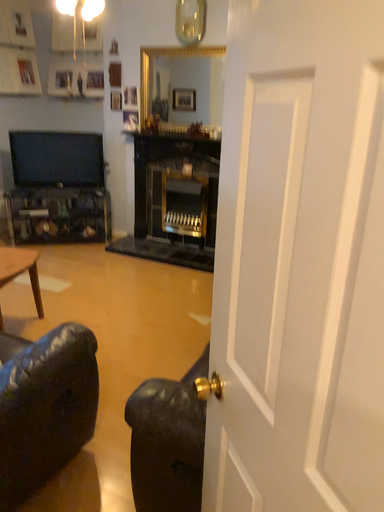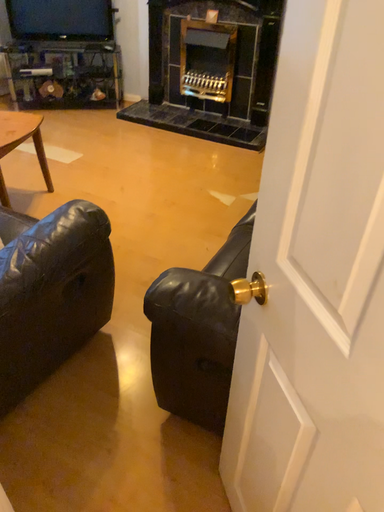
Question: How did the camera likely rotate when shooting the video?

Choices:
 (A) rotated downward
 (B) rotated upward

Answer: (A)